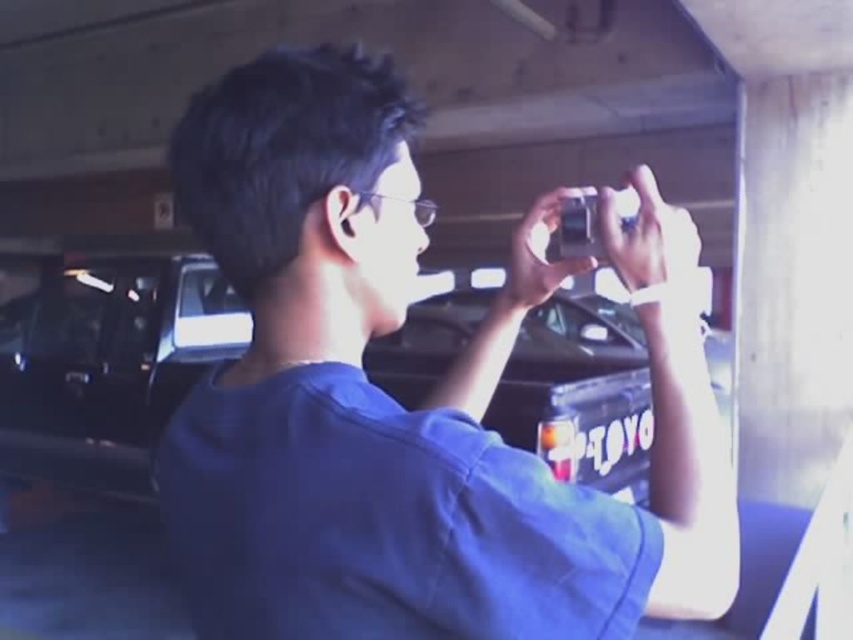
Is blue fabric shirt at center smaller than glossy black truck at center?

Yes.

Is point (392, 291) positioned in front of point (144, 268)?

Yes, point (392, 291) is in front of point (144, 268).

Where is `blue fabric shirt at center`? blue fabric shirt at center is located at coordinates (415, 410).